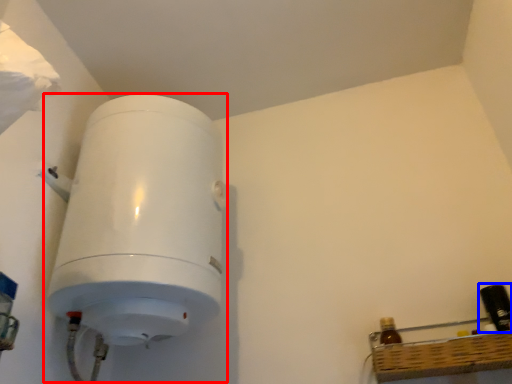
Question: Which of the following is the closest to the observer, appliance (highlighted by a red box) or bottle (highlighted by a blue box)?

Choices:
 (A) appliance
 (B) bottle

Answer: (A)